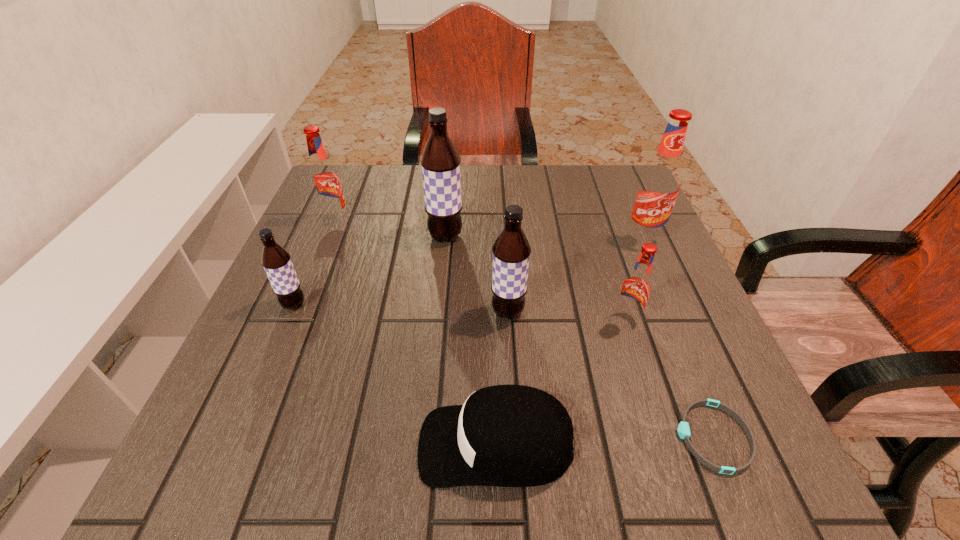
Identify the location of object situated at the far left corner. The image size is (960, 540). (324, 180).

Find the location of a particular element. object located in the near right corner section of the desktop is located at coordinates (683, 429).

Image resolution: width=960 pixels, height=540 pixels. Find the location of `vacant space at the left edge`. vacant space at the left edge is located at coordinates (252, 327).

Identify the location of vacant area at the right edge. This screenshot has height=540, width=960. (600, 254).

In the image, there is a desktop. Identify the location of vacant space at the far left corner. The height and width of the screenshot is (540, 960). (373, 193).

This screenshot has height=540, width=960. In the image, there is a desktop. What are the coordinates of `free space at the far right corner` in the screenshot? It's located at (595, 182).

Where is `vacant space at the near right corner of the desktop`? The height and width of the screenshot is (540, 960). vacant space at the near right corner of the desktop is located at coordinates (660, 446).

The image size is (960, 540). I want to click on vacant region between the rightmost red root beer and the second smallest red root beer, so click(x=490, y=230).

Identify the location of vacant region between the seventh tallest object and the leftmost red root beer. (416, 333).

In order to click on blank region between the biggest red root beer and the second biggest red root beer in this screenshot , I will do `click(490, 230)`.